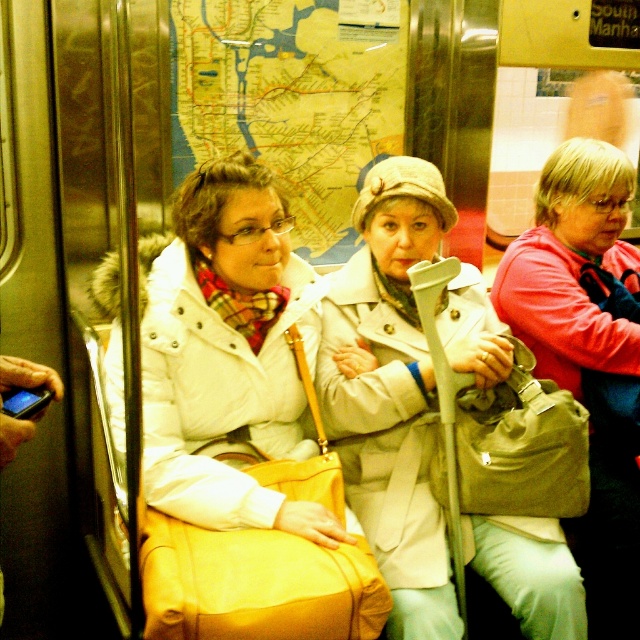
You are a subway passenger trying to sit down. There is a bench seat available between the white matte coat at center and the beige fabric coat at center. Which coat is closer to the empty seat so you can sit next to it?

The white matte coat at center is closer to the empty seat because it is positioned between the beige fabric coat at center and the seat, making it the nearest option.

You are standing on the subway car and want to move from the point at the bottom right corner to the point near the middle left. Is the path clear between point [148,358] and point [621,531]?

Point [148,358] is in front of point [621,531], so the path between them is blocked by the first point.

You are a passenger on the subway and want to hand a document to the person wearing the beige fabric coat at center and the pink fabric jacket at center. Since you can only reach one of them, which one can you hand the document to based on their positions?

The beige fabric coat at center is closer to the viewer than the pink fabric jacket at center, so you can hand the document to the beige fabric coat at center.